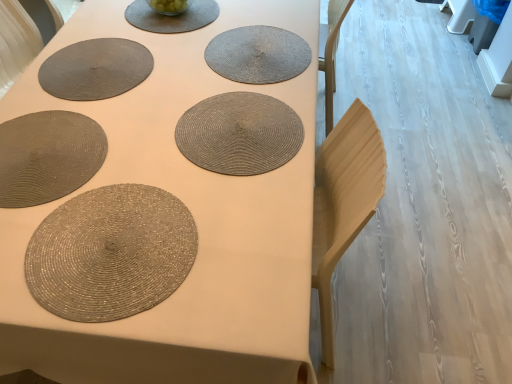
Where is `rattan placemat at lower left, which appears as the second paper plate when viewed from the front`? Image resolution: width=512 pixels, height=384 pixels. rattan placemat at lower left, which appears as the second paper plate when viewed from the front is located at coordinates (48, 156).

What do you see at coordinates (239, 134) in the screenshot?
I see `rattan placemat at center, which appears as the 1th coaster when viewed from the front` at bounding box center [239, 134].

Image resolution: width=512 pixels, height=384 pixels. What do you see at coordinates (95, 69) in the screenshot?
I see `matte gray placemat at upper left, which appears as the 3th paper plate when viewed from the front` at bounding box center [95, 69].

Locate an element on the screen. Image resolution: width=512 pixels, height=384 pixels. rattan placemat at lower left, which appears as the second paper plate when viewed from the front is located at coordinates (48, 156).

Is shiny metallic placemat at bottom left, which ranks as the third paper plate in top-to-bottom order, outside of matte woven placemat at center?

That's incorrect, shiny metallic placemat at bottom left, which ranks as the third paper plate in top-to-bottom order, is not completely outside matte woven placemat at center.

In the scene shown: From the image's perspective, is shiny metallic placemat at bottom left, the 1th paper plate in the bottom-to-top sequence, located above or below matte woven placemat at center?

Based on their image positions, shiny metallic placemat at bottom left, the 1th paper plate in the bottom-to-top sequence, is located beneath matte woven placemat at center.

Is shiny metallic placemat at bottom left, which ranks as the third paper plate in top-to-bottom order, smaller than matte woven placemat at center?

Indeed, shiny metallic placemat at bottom left, which ranks as the third paper plate in top-to-bottom order, has a smaller size compared to matte woven placemat at center.

From a real-world perspective, is shiny metallic placemat at bottom left, the 1th paper plate in the bottom-to-top sequence, located beneath matte woven placemat at center?

No, from a real-world perspective, shiny metallic placemat at bottom left, the 1th paper plate in the bottom-to-top sequence, is not under matte woven placemat at center.

Looking at this image, from a real-world perspective, which is physically above, matte gray placemat at upper center or rattan placemat at center, which appears as the 1th coaster when viewed from the front?

rattan placemat at center, which appears as the 1th coaster when viewed from the front, from a real-world perspective.

Considering the relative positions of matte gray placemat at upper center and rattan placemat at center, the first coaster ordered from the bottom, in the image provided, is matte gray placemat at upper center to the left of rattan placemat at center, the first coaster ordered from the bottom, from the viewer's perspective?

Correct, you'll find matte gray placemat at upper center to the left of rattan placemat at center, the first coaster ordered from the bottom.

Considering the sizes of objects matte gray placemat at upper center and rattan placemat at center, the first coaster ordered from the bottom, in the image provided, who is taller, matte gray placemat at upper center or rattan placemat at center, the first coaster ordered from the bottom,?

With more height is rattan placemat at center, the first coaster ordered from the bottom.

Is rattan placemat at center, which is the 2th coaster in top-to-bottom order, turned away from matte woven placemat at center?

No, rattan placemat at center, which is the 2th coaster in top-to-bottom order, is not facing away from matte woven placemat at center.

Is rattan placemat at center, the first coaster ordered from the bottom, spatially inside matte woven placemat at center, or outside of it?

rattan placemat at center, the first coaster ordered from the bottom, fits inside matte woven placemat at center.

Is the surface of rattan placemat at center, the first coaster ordered from the bottom, in direct contact with matte woven placemat at center?

rattan placemat at center, the first coaster ordered from the bottom, and matte woven placemat at center are clearly separated.

From the image's perspective, is rattan placemat at center, which appears as the 1th coaster when viewed from the front, positioned above or below matte woven placemat at center?

rattan placemat at center, which appears as the 1th coaster when viewed from the front, is below matte woven placemat at center.

Consider the image. From a real-world perspective, which object rests below the other?

In real-world perspective, matte woven placemat at center is lower.

Is matte gray placemat at upper left, which appears as the 3th paper plate when viewed from the front, at the back of matte woven placemat at center?

That's not correct — matte woven placemat at center is not looking away from matte gray placemat at upper left, which appears as the 3th paper plate when viewed from the front.

Who is bigger, matte woven placemat at center or matte gray placemat at upper left, which appears as the first paper plate when viewed from the top?

matte woven placemat at center.

Identify the location of the 3rd paper plate behind the matte woven placemat at center. (95, 69).

Is rattan placemat at lower left, which appears as the second paper plate when viewed from the front, facing away from rattan placemat at center, which appears as the 1th coaster when viewed from the front?

Correct, rattan placemat at lower left, which appears as the second paper plate when viewed from the front, is looking away from rattan placemat at center, which appears as the 1th coaster when viewed from the front.

Can you see rattan placemat at lower left, which appears as the second paper plate when viewed from the front, touching rattan placemat at center, which appears as the 1th coaster when viewed from the front?

rattan placemat at lower left, which appears as the second paper plate when viewed from the front, and rattan placemat at center, which appears as the 1th coaster when viewed from the front, are clearly separated.

From a real-world perspective, is rattan placemat at lower left, the second paper plate viewed from the top, located beneath rattan placemat at center, which is the 2th coaster in top-to-bottom order?

Yes, from a real-world perspective, rattan placemat at lower left, the second paper plate viewed from the top, is below rattan placemat at center, which is the 2th coaster in top-to-bottom order.

From the picture: Is the depth of rattan placemat at lower left, acting as the 2th paper plate starting from the back, greater than that of rattan placemat at center, which appears as the 1th coaster when viewed from the front?

That is False.

Is matte gray placemat at upper center shorter than matte gray placemat at upper left, arranged as the 3th paper plate when ordered from the bottom?

Incorrect, the height of matte gray placemat at upper center does not fall short of that of matte gray placemat at upper left, arranged as the 3th paper plate when ordered from the bottom.

Which is in front, point (203, 11) or point (82, 53)?

The point (82, 53) is closer to the camera.

The image size is (512, 384). I want to click on platter to the right of matte gray placemat at upper left, placed as the first paper plate when sorted from back to front, so click(x=172, y=17).

Is matte gray placemat at upper left, arranged as the 3th paper plate when ordered from the bottom, at the back of matte gray placemat at upper center?

No.

Looking at this image, is rattan placemat at center, the second coaster positioned from the back, touching rattan placemat at center, the 1th coaster from the top?

No, rattan placemat at center, the second coaster positioned from the back, is not beside rattan placemat at center, the 1th coaster from the top.

Between rattan placemat at center, which is the 2th coaster in top-to-bottom order, and rattan placemat at center, the 1th coaster from the top, which one has more height?

rattan placemat at center, which is the 2th coaster in top-to-bottom order, is taller.

The width and height of the screenshot is (512, 384). In order to click on coaster below the rattan placemat at center, which appears as the 1th coaster when viewed from the front (from a real-world perspective) in this screenshot , I will do `click(258, 55)`.

From the matte woven placemat at center, count 1st paper plates backward and point to it. Please provide its 2D coordinates.

[(111, 253)]

From the image's perspective, which coaster is the 2nd one below the matte gray placemat at upper center? Please provide its 2D coordinates.

[(239, 134)]

Which object lies nearer to the anchor point matte gray placemat at upper left, which appears as the first paper plate when viewed from the top, rattan placemat at center, which is the 2th coaster in front-to-back order, or shiny metallic placemat at bottom left, the 1th paper plate in the bottom-to-top sequence?

rattan placemat at center, which is the 2th coaster in front-to-back order, is closer to matte gray placemat at upper left, which appears as the first paper plate when viewed from the top.

Considering their positions, is matte woven placemat at center positioned closer to rattan placemat at center, arranged as the 2th coaster when ordered from the bottom, than matte gray placemat at upper left, arranged as the 3th paper plate when ordered from the bottom?

matte woven placemat at center is closer to rattan placemat at center, arranged as the 2th coaster when ordered from the bottom.

When comparing their distances from shiny metallic placemat at bottom left, the 1th paper plate in the bottom-to-top sequence, does matte woven placemat at center or rattan placemat at center, the first coaster ordered from the bottom, seem further?

rattan placemat at center, the first coaster ordered from the bottom.

Considering their positions, is rattan placemat at center, the first coaster ordered from the bottom, positioned further to matte gray placemat at upper center than shiny metallic placemat at bottom left, which appears as the third paper plate when viewed from the back?

The object further to matte gray placemat at upper center is shiny metallic placemat at bottom left, which appears as the third paper plate when viewed from the back.

Looking at the image, which one is located further to matte woven placemat at center, matte gray placemat at upper left, placed as the first paper plate when sorted from back to front, or rattan placemat at center, the 1th coaster from the top?

rattan placemat at center, the 1th coaster from the top, is further to matte woven placemat at center.

Considering their positions, is rattan placemat at center, which is the 2th coaster in front-to-back order, positioned further to matte gray placemat at upper left, which appears as the first paper plate when viewed from the top, than matte woven placemat at center?

Based on the image, rattan placemat at center, which is the 2th coaster in front-to-back order, appears to be further to matte gray placemat at upper left, which appears as the first paper plate when viewed from the top.

When comparing their distances from matte gray placemat at upper left, placed as the first paper plate when sorted from back to front, does matte woven placemat at center or rattan placemat at lower left, the 2th paper plate positioned from the bottom, seem further?

Based on the image, matte woven placemat at center appears to be further to matte gray placemat at upper left, placed as the first paper plate when sorted from back to front.

Based on their spatial positions, is shiny metallic placemat at bottom left, which appears as the third paper plate when viewed from the back, or matte gray placemat at upper left, placed as the first paper plate when sorted from back to front, further from matte gray placemat at upper center?

shiny metallic placemat at bottom left, which appears as the third paper plate when viewed from the back, lies further to matte gray placemat at upper center than the other object.

Where is `platter situated between matte gray placemat at upper left, which appears as the first paper plate when viewed from the top, and rattan placemat at center, which is the 2th coaster in front-to-back order, from left to right`? Image resolution: width=512 pixels, height=384 pixels. platter situated between matte gray placemat at upper left, which appears as the first paper plate when viewed from the top, and rattan placemat at center, which is the 2th coaster in front-to-back order, from left to right is located at coordinates (172, 17).

You are a GUI agent. You are given a task and a screenshot of the screen. Output one action in this format:
    pyautogui.click(x=<x>, y=<y>)
    Task: Click on the coaster between rattan placemat at center, the 1th coaster from the top, and shiny metallic placemat at bottom left, which is the first paper plate in front-to-back order, vertically
    
    Given the screenshot: What is the action you would take?
    pyautogui.click(x=239, y=134)

What are the coordinates of `paper plate between matte gray placemat at upper center and rattan placemat at lower left, the second paper plate viewed from the top, vertically` in the screenshot? It's located at (95, 69).

This screenshot has width=512, height=384. In order to click on coaster situated between rattan placemat at lower left, which appears as the second paper plate when viewed from the front, and rattan placemat at center, which appears as the first coaster when viewed from the back, from left to right in this screenshot , I will do `click(239, 134)`.